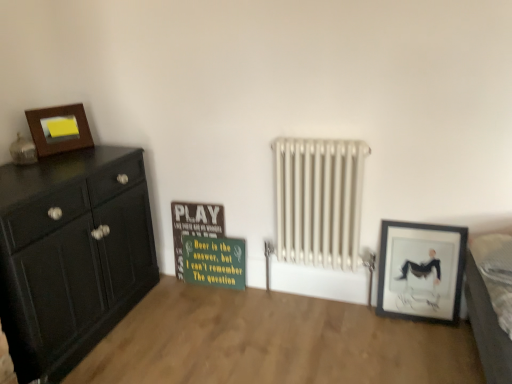
What are the coordinates of `free spot in front of white metallic radiator at center` in the screenshot? It's located at (308, 355).